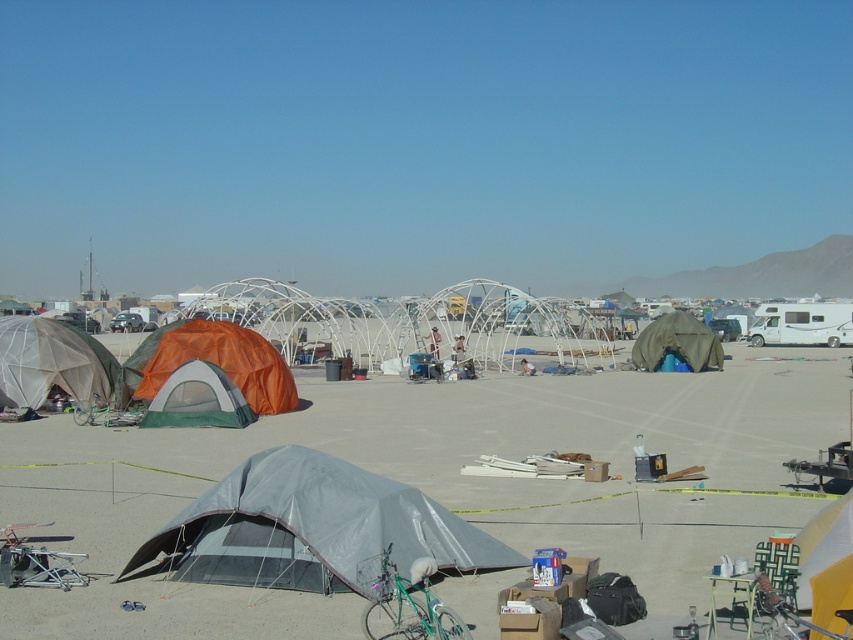
Question: Does gray fabric tent at center have a smaller size compared to gray tarp tent at lower center?

Choices:
 (A) yes
 (B) no

Answer: (B)

Question: Based on their relative distances, which object is nearer to the orange mesh tent at lower left?

Choices:
 (A) green canvas tent at center
 (B) gray tarp tent at lower center

Answer: (B)

Question: Where is gray fabric tent at center located in relation to matte gray tent at left in the image?

Choices:
 (A) left
 (B) right

Answer: (B)

Question: Which point appears farthest from the camera in this image?

Choices:
 (A) (340, 508)
 (B) (175, 355)

Answer: (B)

Question: Among these points, which one is farthest from the camera?

Choices:
 (A) (651, 390)
 (B) (0, 346)
 (C) (701, 332)

Answer: (C)

Question: Considering the relative positions of gray fabric tent at center and gray tarp tent at lower center in the image provided, where is gray fabric tent at center located with respect to gray tarp tent at lower center?

Choices:
 (A) right
 (B) left

Answer: (A)